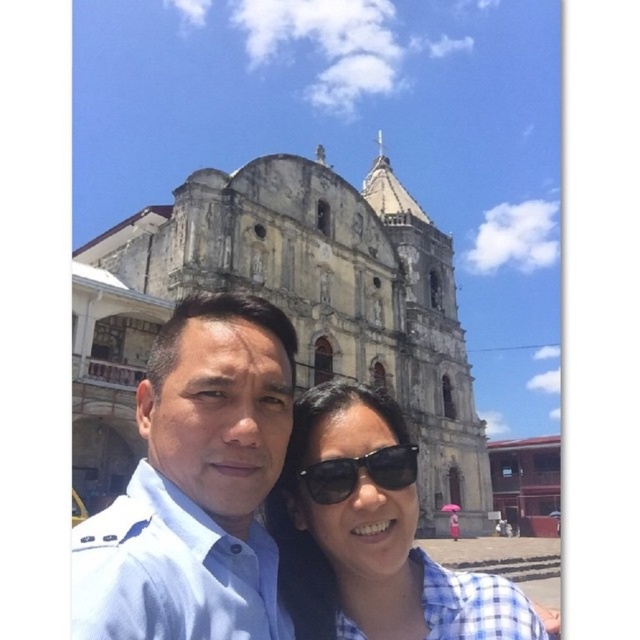
Is point (138, 376) in front of point (256, 387)?

No.

Is point (472, 392) farther from camera compared to point (140, 536)?

That is True.

Locate an element on the screen. This screenshot has height=640, width=640. stone church at center is located at coordinates (285, 308).

Is blue uniform shirt at center further to the viewer compared to checkered fabric shirt at center?

No, it is in front of checkered fabric shirt at center.

Which is above, blue uniform shirt at center or checkered fabric shirt at center?

Positioned higher is blue uniform shirt at center.

Does point (262, 371) lie behind point (428, 572)?

No, (262, 371) is in front of (428, 572).

The image size is (640, 640). Identify the location of blue uniform shirt at center. (195, 484).

Can you confirm if matte blue shirt at center is positioned to the left of blue uniform shirt at center?

Indeed, matte blue shirt at center is positioned on the left side of blue uniform shirt at center.

Which is in front, point (80, 612) or point (134, 570)?

Point (80, 612) is in front.

The width and height of the screenshot is (640, 640). Find the location of `matte blue shirt at center`. matte blue shirt at center is located at coordinates (196, 486).